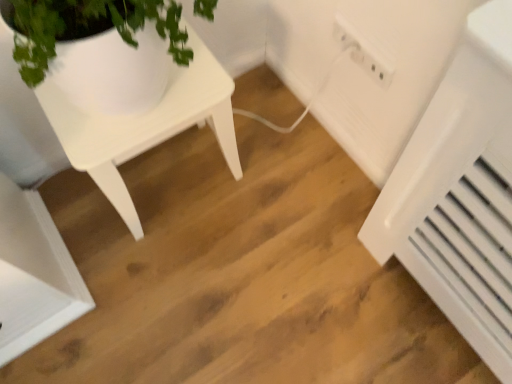
Question: Is white plastic electric outlet at upper right oriented away from white plastic radiator at lower right?

Choices:
 (A) no
 (B) yes

Answer: (A)

Question: From a real-world perspective, is white plastic electric outlet at upper right located beneath white plastic radiator at lower right?

Choices:
 (A) yes
 (B) no

Answer: (B)

Question: Does white plastic electric outlet at upper right appear on the right side of white plastic radiator at lower right?

Choices:
 (A) no
 (B) yes

Answer: (A)

Question: From a real-world perspective, is white plastic electric outlet at upper right located higher than white plastic radiator at lower right?

Choices:
 (A) no
 (B) yes

Answer: (B)

Question: Does white plastic electric outlet at upper right turn towards white plastic radiator at lower right?

Choices:
 (A) yes
 (B) no

Answer: (B)

Question: Can you confirm if white plastic electric outlet at upper right is positioned to the left of white plastic radiator at lower right?

Choices:
 (A) yes
 (B) no

Answer: (A)

Question: From a real-world perspective, is white plastic radiator at lower right under white matte table at upper left?

Choices:
 (A) yes
 (B) no

Answer: (A)

Question: Are white plastic radiator at lower right and white matte table at upper left far apart?

Choices:
 (A) no
 (B) yes

Answer: (A)

Question: Could you tell me if white plastic radiator at lower right is facing white matte table at upper left?

Choices:
 (A) yes
 (B) no

Answer: (B)

Question: From a real-world perspective, is white plastic radiator at lower right physically above white matte table at upper left?

Choices:
 (A) yes
 (B) no

Answer: (B)

Question: Is white plastic radiator at lower right outside of white matte table at upper left?

Choices:
 (A) yes
 (B) no

Answer: (A)

Question: Is white plastic radiator at lower right smaller than white matte table at upper left?

Choices:
 (A) yes
 (B) no

Answer: (A)

Question: From a real-world perspective, is white matte table at upper left beneath white plastic electric outlet at upper right?

Choices:
 (A) yes
 (B) no

Answer: (A)